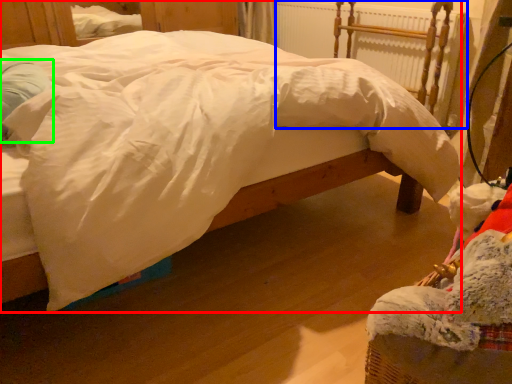
Question: Which object is the closest to the bed (highlighted by a red box)? Choose among these: radiator (highlighted by a blue box) or pillow (highlighted by a green box).

Choices:
 (A) radiator
 (B) pillow

Answer: (B)